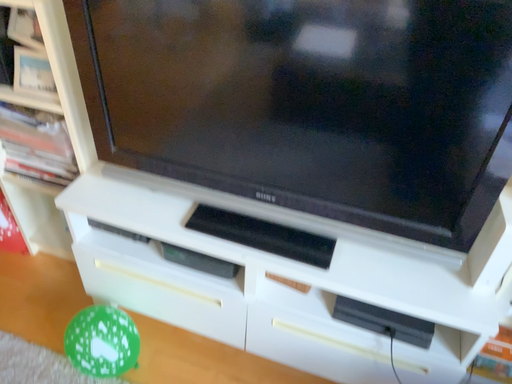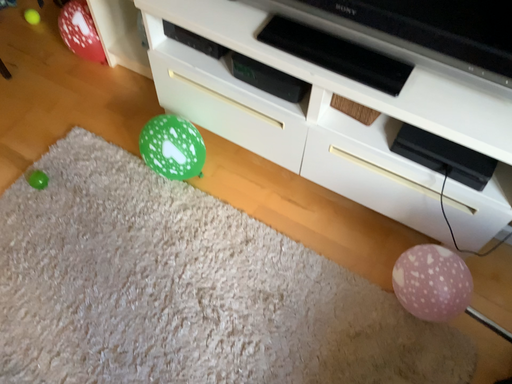
Question: How did the camera likely rotate when shooting the video?

Choices:
 (A) rotated left
 (B) rotated right

Answer: (A)